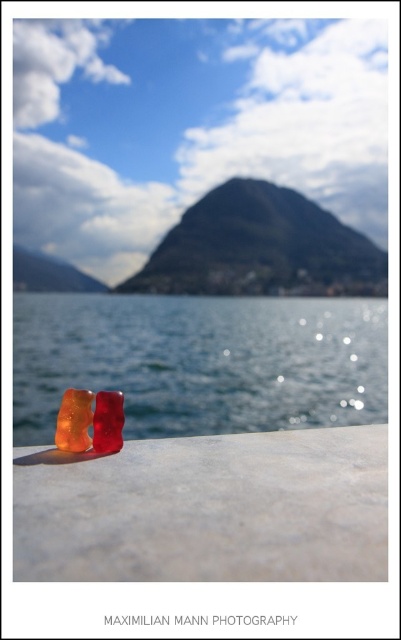
You are a tiny explorer who wants to climb the matte black mountain at upper center. However, you notice the matte stone gummy bears at center in your way. Considering their sizes, do you think you can easily step over them to reach the mountain?

The matte stone gummy bears at center are larger in size compared to the matte black mountain at upper center. Since the gummy bears are bigger, it would be challenging to step over them to reach the mountain.